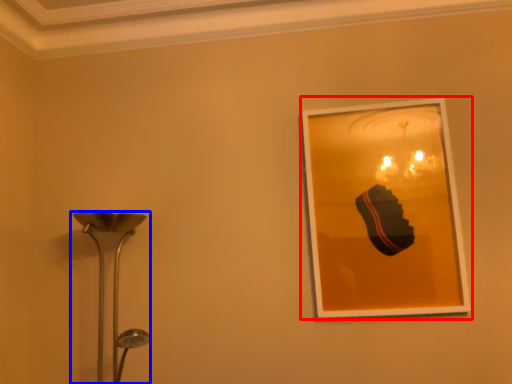
Question: Which of the following is the farthest to the observer, picture frame (highlighted by a red box) or lamp (highlighted by a blue box)?

Choices:
 (A) picture frame
 (B) lamp

Answer: (A)